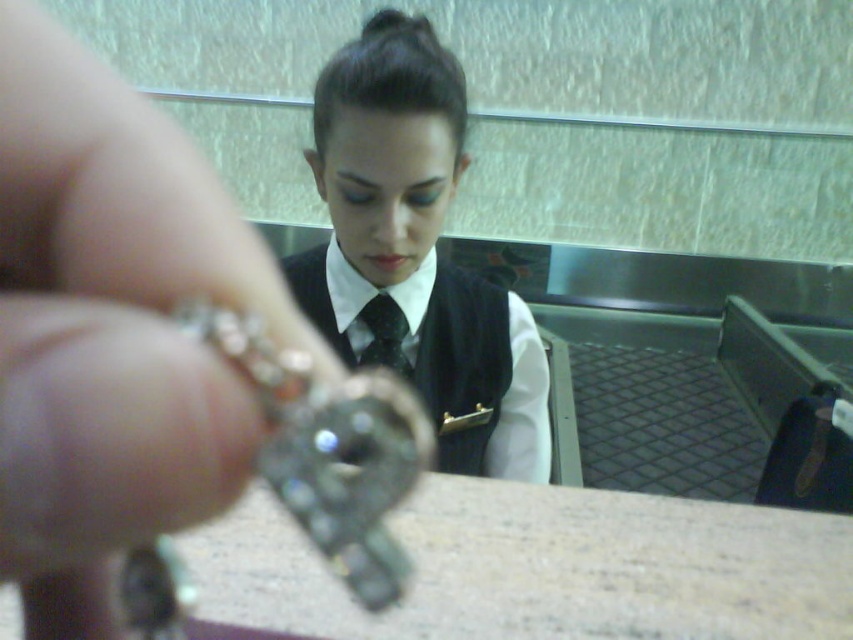
You are a jeweler who needs to place the silver metallic ring at upper left into a display case located near the black satin vest at center. The display case is exactly 1 meter away from the vest. Can the ring be placed into the display case without moving the vest?

The silver metallic ring at upper left is 91.21 centimeters from the black satin vest at center. Since the display case is exactly 1 meter away from the vest, the ring is within the required distance and can be placed into the display case without moving the vest.